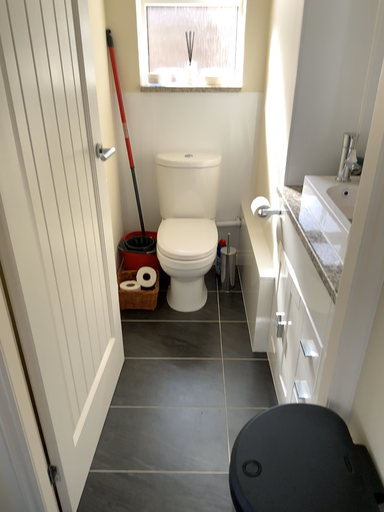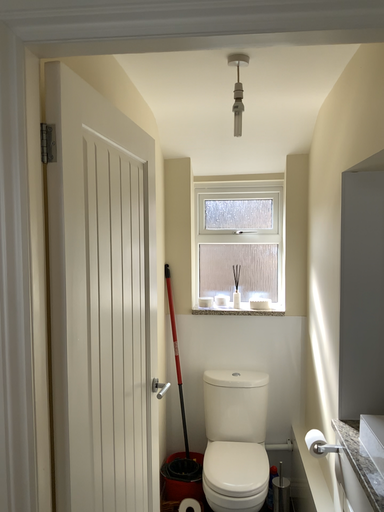
Question: Which way did the camera rotate in the video?

Choices:
 (A) rotated upward
 (B) rotated downward

Answer: (A)